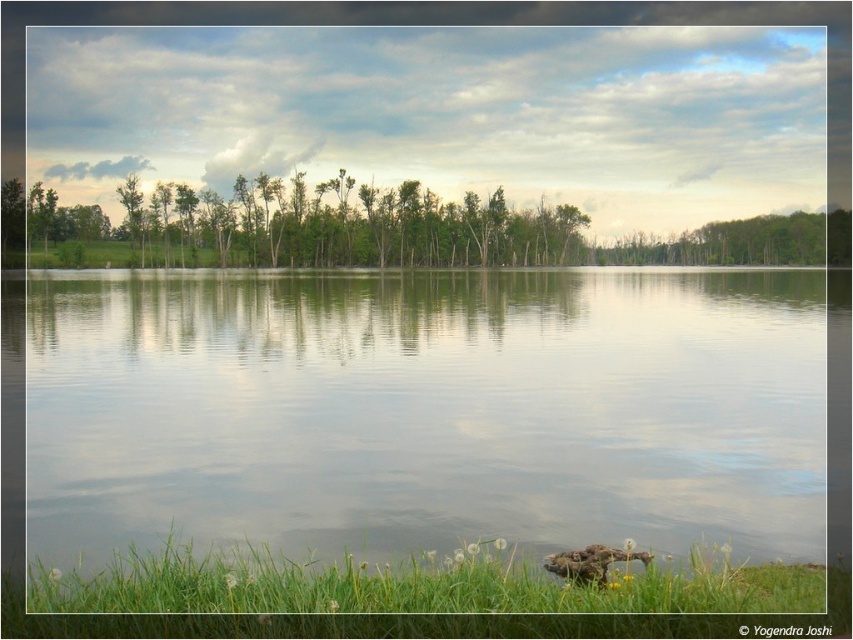
Between clear water at center and brown fuzzy duck at lower center, which one has more height?

clear water at center is taller.

Is clear water at center above brown fuzzy duck at lower center?

Indeed, clear water at center is positioned over brown fuzzy duck at lower center.

Identify the location of clear water at center. (425, 410).

Looking at this image, which is more to the right, clear water at center or green grass at lower center?

From the viewer's perspective, green grass at lower center appears more on the right side.

Does clear water at center come behind green grass at lower center?

Yes.

The width and height of the screenshot is (853, 640). Describe the element at coordinates (425, 410) in the screenshot. I see `clear water at center` at that location.

Find the location of a particular element. This screenshot has width=853, height=640. clear water at center is located at coordinates (425, 410).

Is green grass at lower center to the left of brown fuzzy duck at lower center from the viewer's perspective?

Indeed, green grass at lower center is positioned on the left side of brown fuzzy duck at lower center.

Measure the distance between point (518,580) and camera.

Point (518,580) and camera are 6.79 meters apart.

What do you see at coordinates (410, 596) in the screenshot? The height and width of the screenshot is (640, 853). I see `green grass at lower center` at bounding box center [410, 596].

Locate an element on the screen. green grass at lower center is located at coordinates (410, 596).